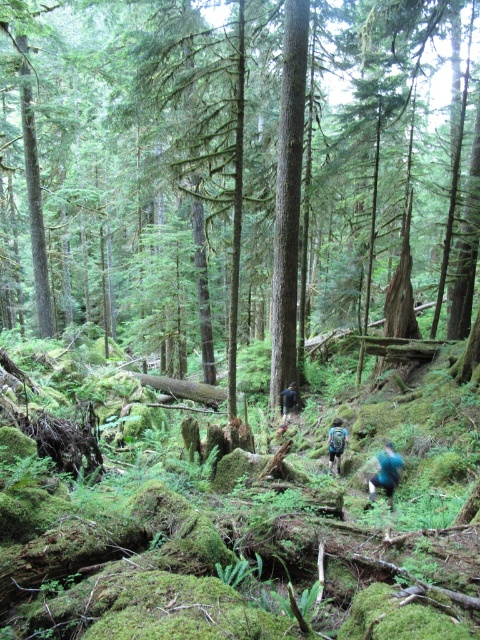
Question: Can you confirm if teal fabric backpack at lower center is positioned below dark blue backpack at center?

Choices:
 (A) no
 (B) yes

Answer: (B)

Question: Estimate the real-world distances between objects in this image. Which object is closer to the green mossy tree at center?

Choices:
 (A) dark blue backpack at center
 (B) teal fabric backpack at lower center
 (C) blue fabric backpack at center

Answer: (A)

Question: Estimate the real-world distances between objects in this image. Which object is closer to the teal fabric backpack at lower center?

Choices:
 (A) blue fabric backpack at center
 (B) green mossy tree at center

Answer: (A)

Question: Can you confirm if blue fabric backpack at center is wider than dark blue backpack at center?

Choices:
 (A) yes
 (B) no

Answer: (B)

Question: Considering the relative positions of teal fabric backpack at lower center and blue fabric backpack at center in the image provided, where is teal fabric backpack at lower center located with respect to blue fabric backpack at center?

Choices:
 (A) left
 (B) right

Answer: (B)

Question: Which point appears farthest from the camera in this image?

Choices:
 (A) (384, 460)
 (B) (252, 264)

Answer: (B)